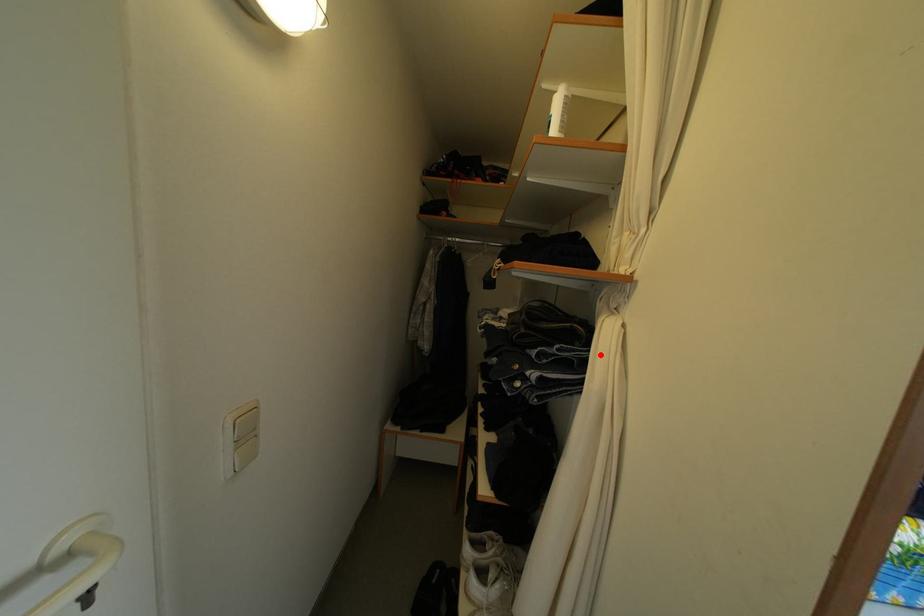
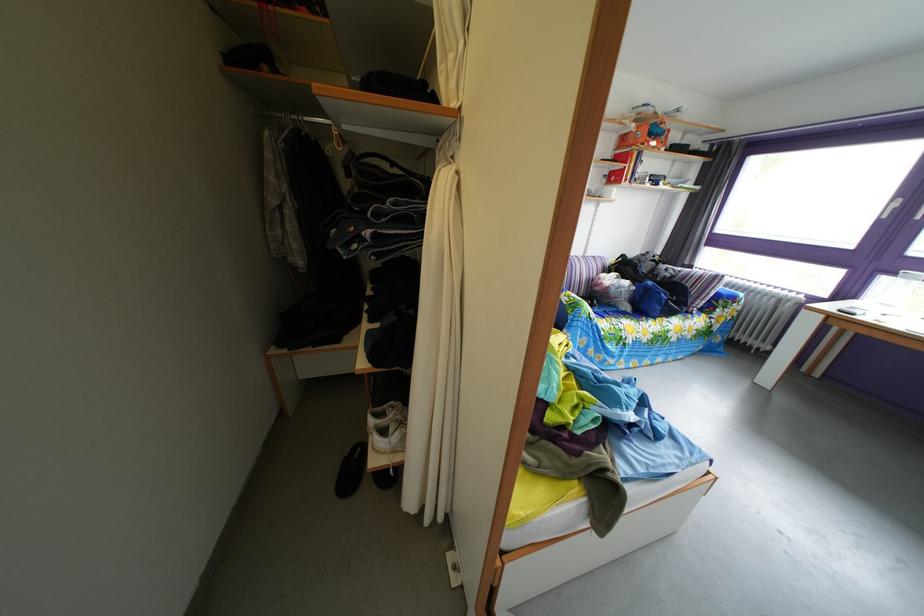
Where in the second image is the point corresponding to the highlighted location from the first image?

(438, 207)